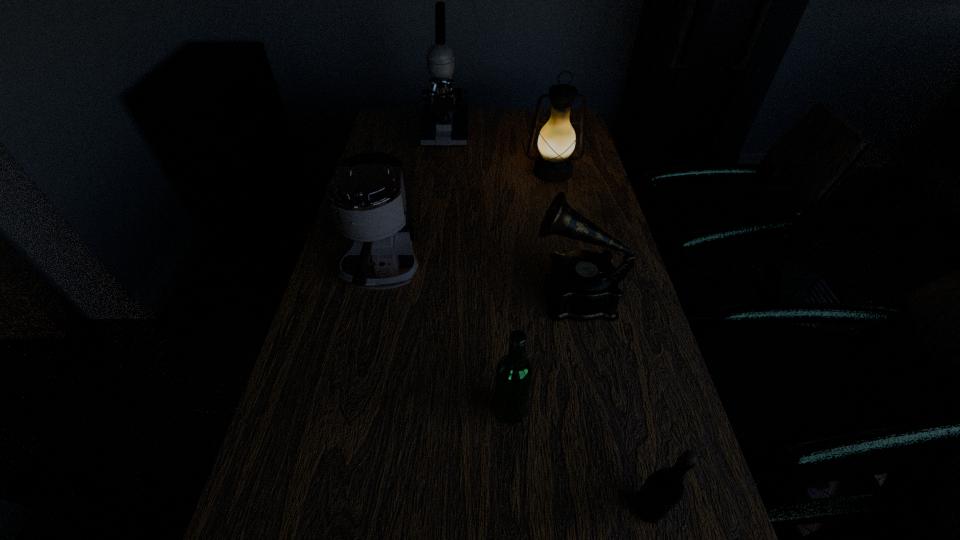
Identify the location of phonograph record at the right edge. This screenshot has height=540, width=960. (582, 285).

You are a GUI agent. You are given a task and a screenshot of the screen. Output one action in this format:
    pyautogui.click(x=<x>, y=<y>)
    Task: Click on the beer bottle that is positioned at the right edge
    The width and height of the screenshot is (960, 540).
    Given the screenshot: What is the action you would take?
    pyautogui.click(x=664, y=489)

At what (x,y) coordinates should I click in order to perform the action: click on vacant space at the far edge of the desktop. Please return your answer as a coordinate pair (x, y). This screenshot has height=540, width=960. Looking at the image, I should click on (512, 126).

Find the location of a particular element. The width and height of the screenshot is (960, 540). blank area at the left edge is located at coordinates (406, 154).

At what (x,y) coordinates should I click in order to perform the action: click on vacant region at the right edge. Please return your answer as a coordinate pair (x, y). Looking at the image, I should click on (666, 414).

I want to click on free space at the far left corner of the desktop, so click(x=381, y=134).

Locate an element on the screen. empty space that is in between the phonograph record and the coffee maker is located at coordinates (479, 284).

Locate an element on the screen. The image size is (960, 540). vacant area that lies between the farther beer bottle and the nearer beer bottle is located at coordinates [580, 459].

I want to click on vacant point located between the oil lamp and the farthest object, so click(x=499, y=152).

I want to click on free area in between the coffee maker and the oil lamp, so click(468, 222).